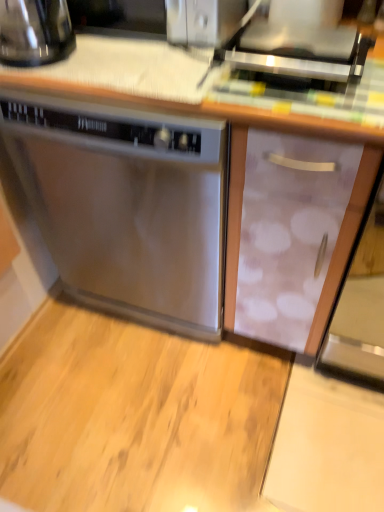
At what (x,y) coordinates should I click in order to perform the action: click on vacant area to the left of satin silver toaster at upper center. Please return your answer as a coordinate pair (x, y). Looking at the image, I should click on click(175, 79).